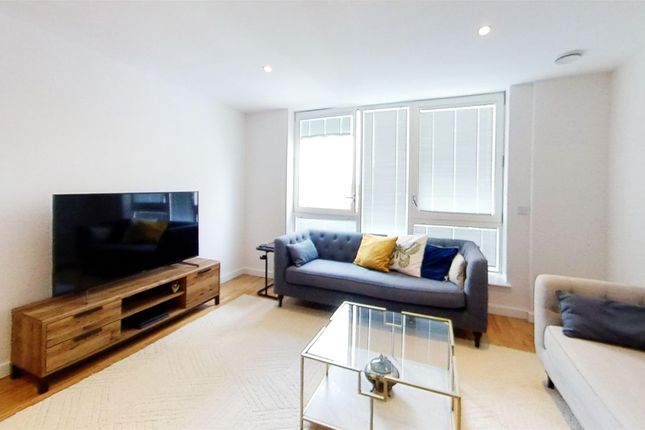
You are a GUI agent. You are given a task and a screenshot of the screen. Output one action in this format:
    pyautogui.click(x=<x>, y=<y>)
    Task: Click on the wall
    Image resolution: width=645 pixels, height=430 pixels.
    Given the screenshot: What is the action you would take?
    pyautogui.click(x=183, y=148), pyautogui.click(x=263, y=162), pyautogui.click(x=571, y=183)